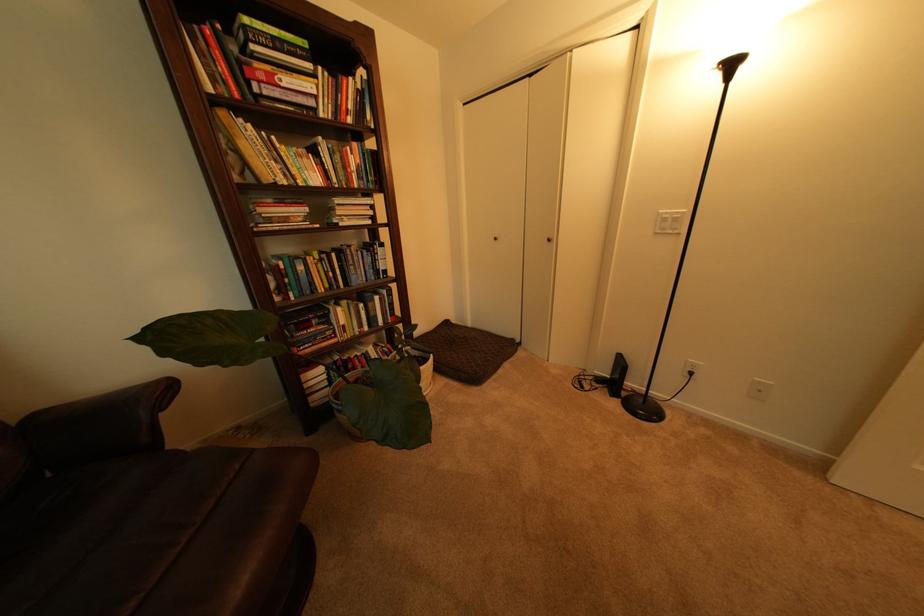
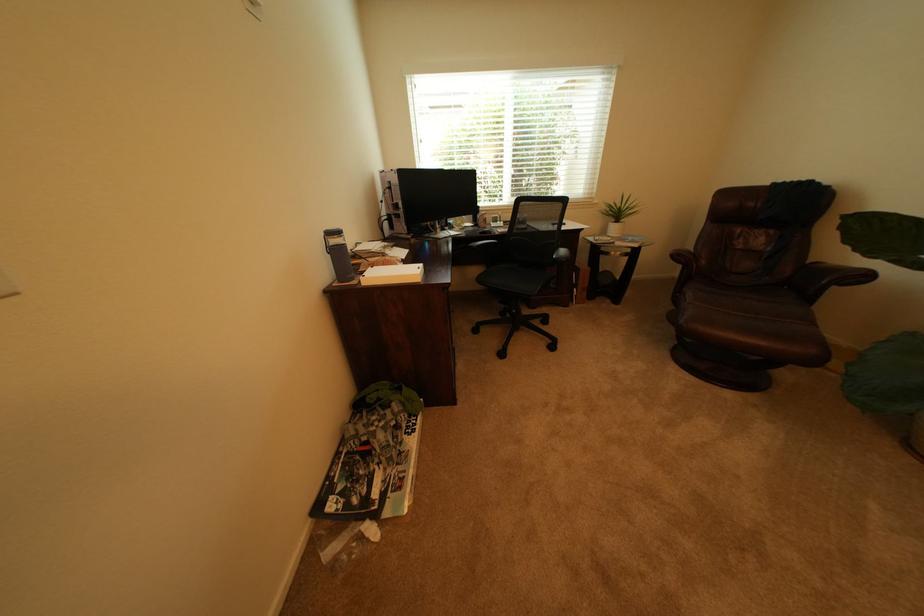
Find the pixel in the second image that matches point (28, 424) in the first image.

(821, 262)